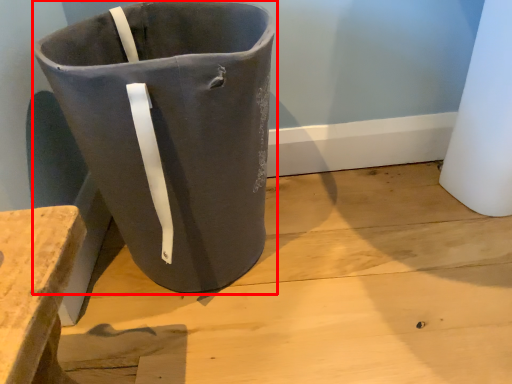
Question: From the image's perspective, considering the relative positions of waste container (annotated by the red box) and concrete in the image provided, where is waste container (annotated by the red box) located with respect to the staircase?

Choices:
 (A) above
 (B) below

Answer: (A)